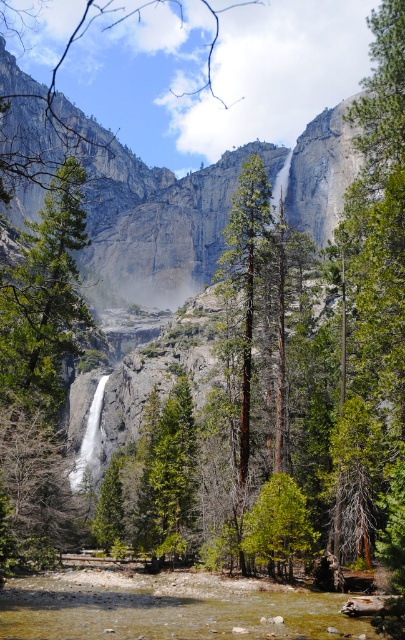
You are a hiker standing at the base of the waterfall. You notice a green matte tree at left and a brown rough tree at center. Which tree would block your view more if you were to walk towards the waterfall from the river? Explain your reasoning.

The green matte tree at left would block your view more because it has a larger size compared to the brown rough tree at center.

You are planning to take a photo of the gray rock face at center and the green matte tree at left. Which object should you focus on first if you want to capture both in the same frame without moving the camera?

The gray rock face at center is wider than the green matte tree at left, so you should focus on the gray rock face at center first to ensure it fits within the frame.